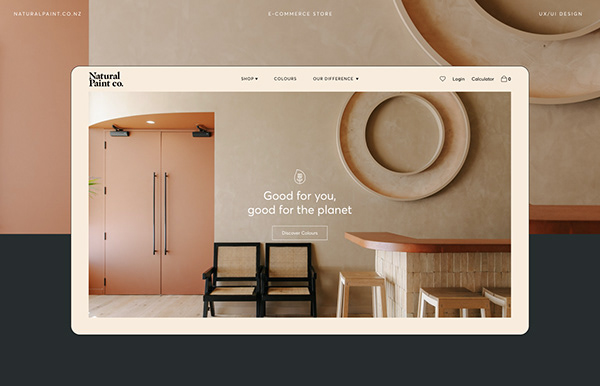
Locate an element on the screen. lighting is located at coordinates (150, 121).